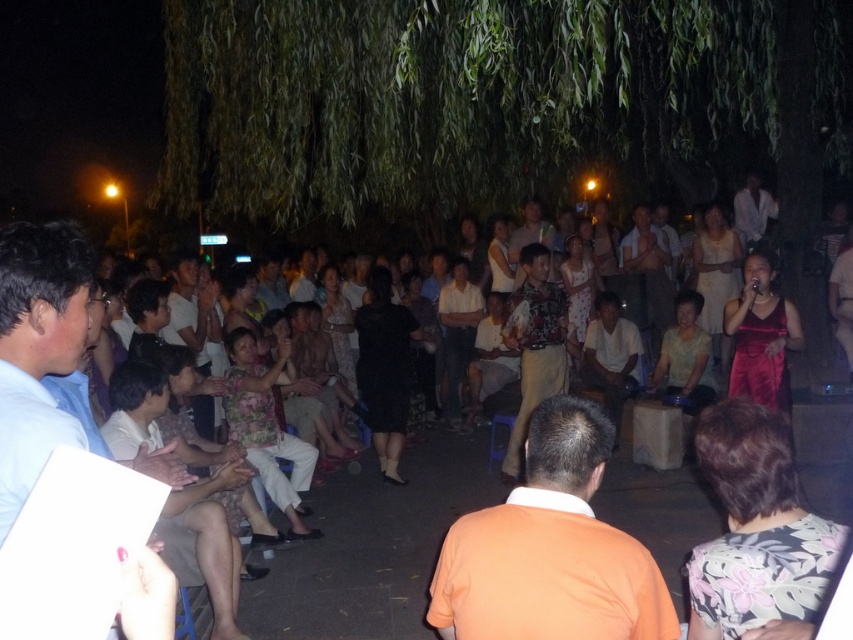
Question: In this image, where is light blue shirt at left located relative to light brown wood chair at lower left?

Choices:
 (A) left
 (B) right

Answer: (B)

Question: Which point is farther from the camera taking this photo?

Choices:
 (A) (692, 532)
 (B) (602, 440)
 (C) (61, 428)

Answer: (A)

Question: Which object is positioned closest to the light blue shirt at left?

Choices:
 (A) floral dress at center
 (B) light brown wood chair at lower left

Answer: (B)

Question: Can you confirm if floral dress at center is positioned below light blue shirt at left?

Choices:
 (A) no
 (B) yes

Answer: (B)

Question: Which of the following is the farthest from the observer?

Choices:
 (A) light blue shirt at left
 (B) orange cotton shirt at center
 (C) light brown wood chair at lower left

Answer: (C)

Question: Observing the image, what is the correct spatial positioning of light blue shirt at left in reference to light brown wood chair at lower left?

Choices:
 (A) right
 (B) left

Answer: (A)